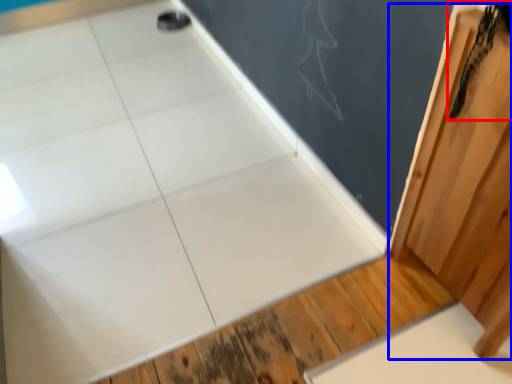
Question: Among these objects, which one is nearest to the camera, animal (highlighted by a red box) or barn door (highlighted by a blue box)?

Choices:
 (A) animal
 (B) barn door

Answer: (B)